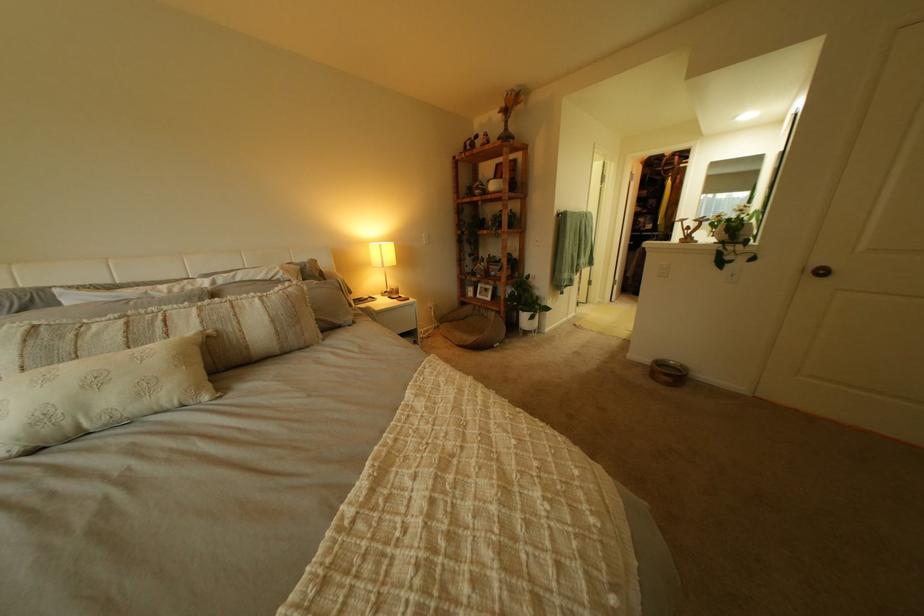
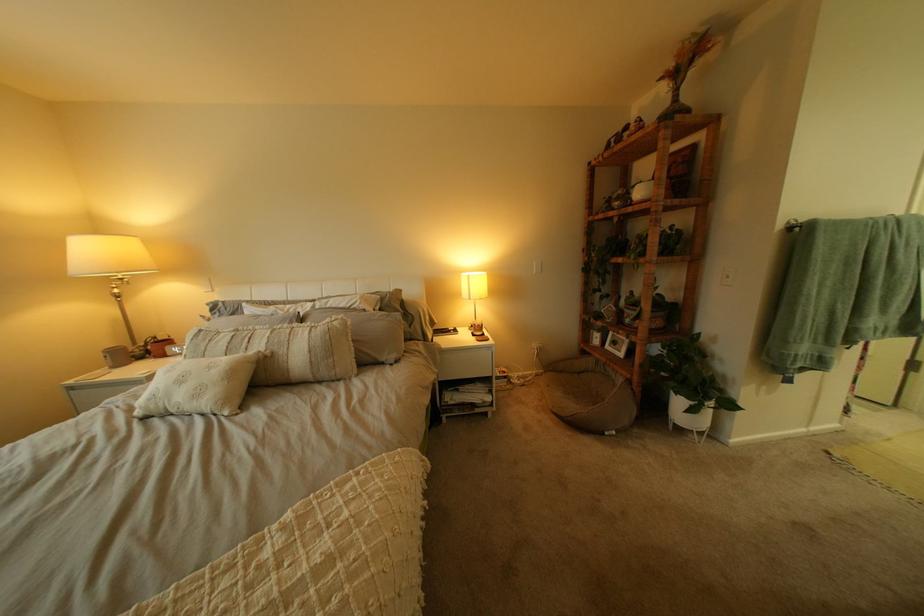
In the second image, find the point that corresponds to pixel 80 424 in the first image.

(176, 405)